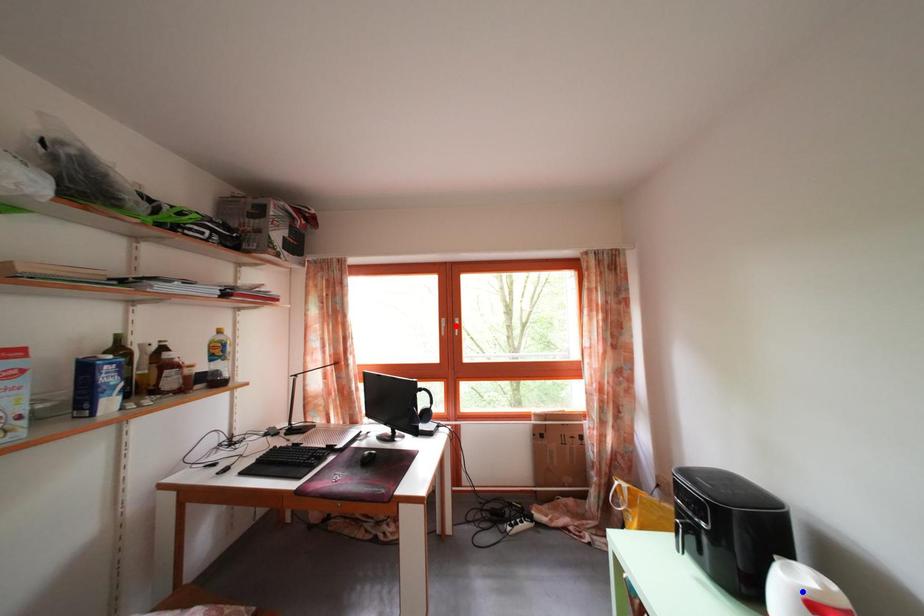
Question: Which of the two points in the image is closer to the camera?

Choices:
 (A) Blue point is closer.
 (B) Red point is closer.

Answer: (A)